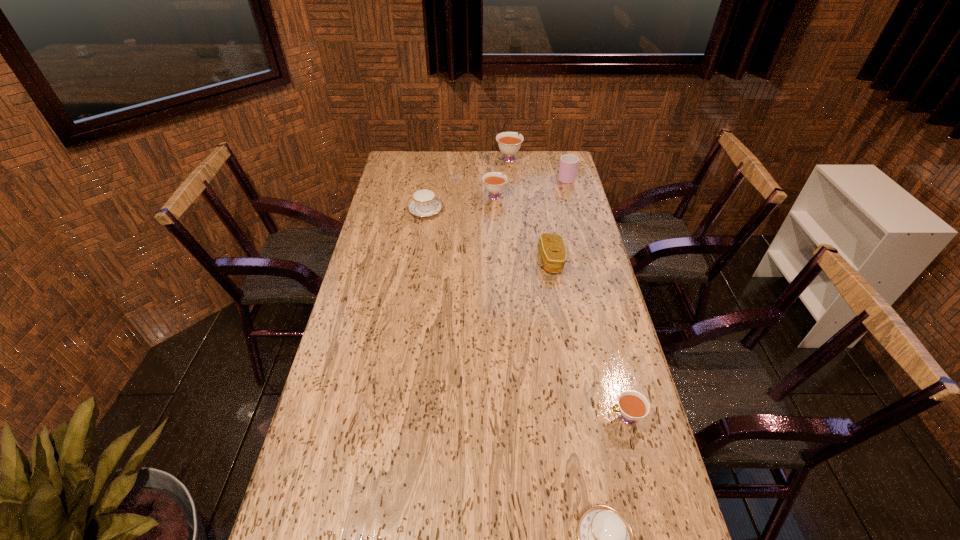
Identify the location of vacant position located 0.260m on the side with the handle of the left blue teacup. This screenshot has height=540, width=960. (432, 170).

Locate an element on the screen. The image size is (960, 540). free space located 0.110m on the side with the handle of the left blue teacup is located at coordinates (429, 187).

This screenshot has height=540, width=960. I want to click on vacant space located on the side of the fourth farthest teacup with the handle, so click(x=469, y=417).

Find the location of a particular element. vacant space positioned on the side of the fourth farthest teacup with the handle is located at coordinates (511, 417).

You are a GUI agent. You are given a task and a screenshot of the screen. Output one action in this format:
    pyautogui.click(x=<x>, y=<y>)
    Task: Click on the vacant space situated 0.220m on the side of the fourth farthest teacup with the handle
    
    Given the screenshot: What is the action you would take?
    pyautogui.click(x=526, y=417)

Find the location of a particular element. The image size is (960, 540). teacup present at the far edge is located at coordinates coord(509,143).

Locate an element on the screen. cup present at the far edge is located at coordinates (568, 166).

The height and width of the screenshot is (540, 960). Identify the location of object positioned at the left edge. (424, 203).

Where is `cup that is at the right edge`? The image size is (960, 540). cup that is at the right edge is located at coordinates (568, 166).

The image size is (960, 540). I want to click on clutch bag positioned at the right edge, so click(552, 249).